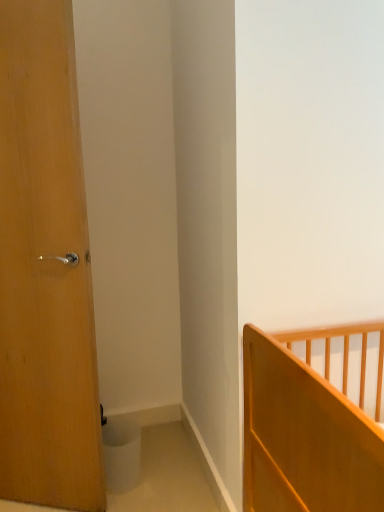
Question: Based on their sizes in the image, would you say light brown wooden bed at lower right is bigger or smaller than light wood door at left?

Choices:
 (A) big
 (B) small

Answer: (A)

Question: Which is correct: light brown wooden bed at lower right is inside light wood door at left, or outside of it?

Choices:
 (A) inside
 (B) outside

Answer: (B)

Question: From the image's perspective, relative to light wood door at left, is light brown wooden bed at lower right above or below?

Choices:
 (A) above
 (B) below

Answer: (B)

Question: From a real-world perspective, is light wood door at left positioned above or below light brown wooden bed at lower right?

Choices:
 (A) above
 (B) below

Answer: (A)

Question: Relative to light brown wooden bed at lower right, is light wood door at left in front or behind?

Choices:
 (A) front
 (B) behind

Answer: (B)

Question: Is light wood door at left wider or thinner than light brown wooden bed at lower right?

Choices:
 (A) thin
 (B) wide

Answer: (A)

Question: In terms of height, does light wood door at left look taller or shorter compared to light brown wooden bed at lower right?

Choices:
 (A) tall
 (B) short

Answer: (A)